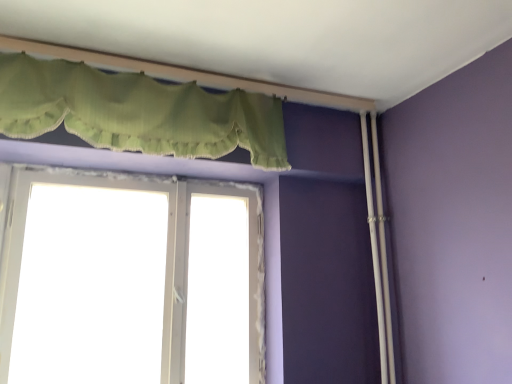
Question: Is green fabric valance at upper center at the left side of white plastic window at center?

Choices:
 (A) no
 (B) yes

Answer: (A)

Question: Is green fabric valance at upper center oriented away from white plastic window at center?

Choices:
 (A) yes
 (B) no

Answer: (B)

Question: Considering the relative sizes of green fabric valance at upper center and white plastic window at center in the image provided, is green fabric valance at upper center smaller than white plastic window at center?

Choices:
 (A) no
 (B) yes

Answer: (A)

Question: Is green fabric valance at upper center not within white plastic window at center?

Choices:
 (A) yes
 (B) no

Answer: (A)

Question: Is green fabric valance at upper center aimed at white plastic window at center?

Choices:
 (A) no
 (B) yes

Answer: (A)

Question: From the image's perspective, would you say green fabric valance at upper center is positioned over white plastic window at center?

Choices:
 (A) yes
 (B) no

Answer: (A)

Question: Considering the relative sizes of white plastic window at center and green fabric valance at upper center in the image provided, is white plastic window at center wider than green fabric valance at upper center?

Choices:
 (A) no
 (B) yes

Answer: (A)

Question: Does white plastic window at center have a greater height compared to green fabric valance at upper center?

Choices:
 (A) no
 (B) yes

Answer: (B)

Question: Could you tell me if white plastic window at center is turned towards green fabric valance at upper center?

Choices:
 (A) yes
 (B) no

Answer: (A)

Question: Is white plastic window at center touching green fabric valance at upper center?

Choices:
 (A) no
 (B) yes

Answer: (A)

Question: Is white plastic window at center at the right side of green fabric valance at upper center?

Choices:
 (A) yes
 (B) no

Answer: (B)

Question: Can you confirm if white plastic window at center is bigger than green fabric valance at upper center?

Choices:
 (A) no
 (B) yes

Answer: (A)

Question: From a real-world perspective, is green fabric valance at upper center above or below white plastic window at center?

Choices:
 (A) below
 (B) above

Answer: (B)